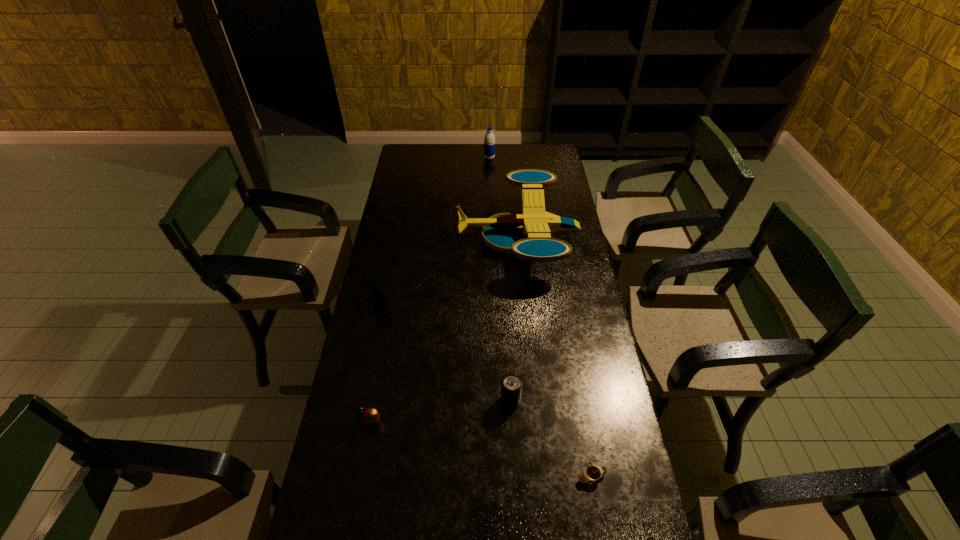
You are a GUI agent. You are given a task and a screenshot of the screen. Output one action in this format:
    pyautogui.click(x=<x>, y=<y>)
    Task: Click on the empty space between the Lego and the water bottle
    The height and width of the screenshot is (540, 960).
    Given the screenshot: What is the action you would take?
    pyautogui.click(x=435, y=232)

Where is `free space that is in between the Lego and the drone`? Image resolution: width=960 pixels, height=540 pixels. free space that is in between the Lego and the drone is located at coordinates (448, 273).

Where is `vacant space that is in between the third farthest object and the nearest object`? vacant space that is in between the third farthest object and the nearest object is located at coordinates (486, 392).

What are the coordinates of `free point between the farthest object and the nearest object` in the screenshot? It's located at (540, 318).

You are a GUI agent. You are given a task and a screenshot of the screen. Output one action in this format:
    pyautogui.click(x=<x>, y=<y>)
    Task: Click on the vacant space in between the third nearest object and the second nearest object
    
    Given the screenshot: What is the action you would take?
    pyautogui.click(x=441, y=411)

Identify which object is the fifth nearest to the second nearest object. Please provide its 2D coordinates. Your answer should be formatted as a tuple, i.e. [(x, y)], where the tuple contains the x and y coordinates of a point satisfying the conditions above.

[(489, 140)]

This screenshot has width=960, height=540. In order to click on object that stands as the second closest to the shortest object in this screenshot , I will do `click(366, 417)`.

I want to click on vacant region that satisfies the following two spatial constraints: 1. on the face of the shortest object; 2. on the right side of the Lego, so click(x=345, y=477).

The height and width of the screenshot is (540, 960). I want to click on vacant area that satisfies the following two spatial constraints: 1. on the face of the Lego; 2. on the left side of the nearest object, so click(x=345, y=477).